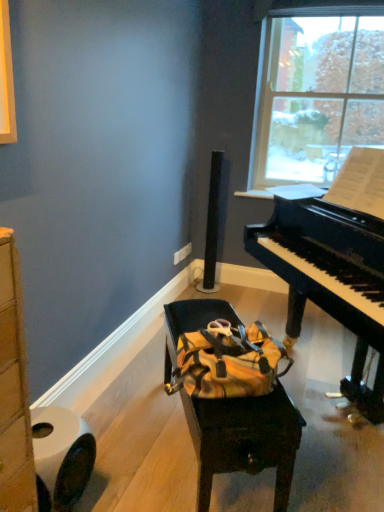
Question: In terms of height, does yellow fabric bag at center look taller or shorter compared to transparent glass window at upper right?

Choices:
 (A) tall
 (B) short

Answer: (B)

Question: Is yellow fabric bag at center bigger or smaller than transparent glass window at upper right?

Choices:
 (A) small
 (B) big

Answer: (B)

Question: Which is farther from the white matte toilet paper at lower left?

Choices:
 (A) yellow fabric bag at center
 (B) black polished piano at right
 (C) transparent glass window at upper right

Answer: (C)

Question: Which is farther from the yellow fabric bag at center?

Choices:
 (A) white matte toilet paper at lower left
 (B) transparent glass window at upper right
 (C) black polished piano at right

Answer: (B)